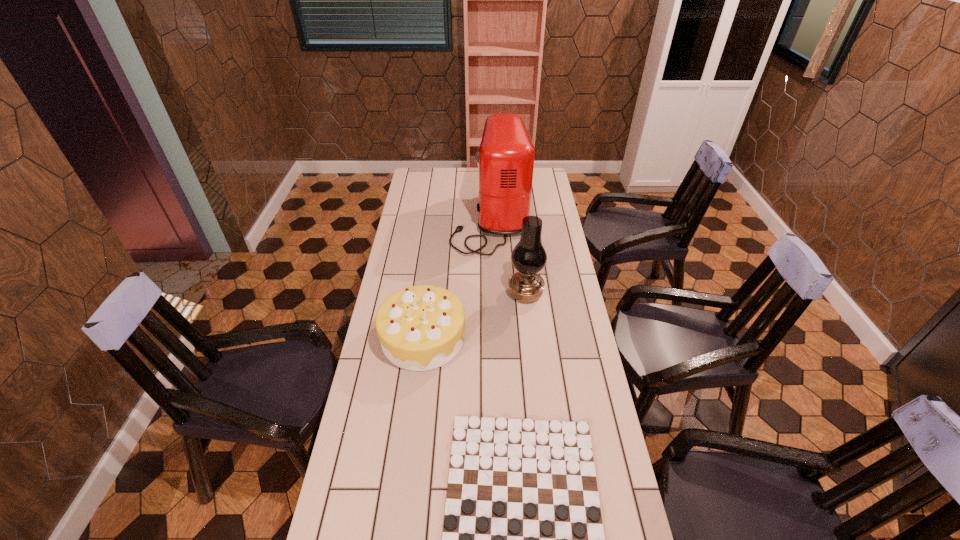
Find the location of a particular element. the tallest object is located at coordinates (505, 159).

What are the coordinates of `the farthest object` in the screenshot? It's located at (505, 159).

Find the location of a particular element. The height and width of the screenshot is (540, 960). the second farthest object is located at coordinates (529, 257).

You are a GUI agent. You are given a task and a screenshot of the screen. Output one action in this format:
    pyautogui.click(x=<x>, y=<y>)
    Task: Click on the oil lamp
    The height and width of the screenshot is (540, 960).
    Given the screenshot: What is the action you would take?
    pyautogui.click(x=529, y=257)

The width and height of the screenshot is (960, 540). I want to click on the third tallest object, so click(422, 327).

What are the coordinates of `the second nearest object` in the screenshot? It's located at (422, 327).

This screenshot has width=960, height=540. In order to click on vacant region located on the front-facing side of the kitchen mixer in this screenshot , I will do `click(439, 220)`.

What are the coordinates of `vacant position located 0.140m on the front-facing side of the kitchen mixer` in the screenshot? It's located at (422, 220).

You are a GUI agent. You are given a task and a screenshot of the screen. Output one action in this format:
    pyautogui.click(x=<x>, y=<y>)
    Task: Click on the free region located on the front-facing side of the kitchen mixer
    This screenshot has width=960, height=540.
    Given the screenshot: What is the action you would take?
    pyautogui.click(x=428, y=220)

Where is `vacant region located 0.050m on the right of the third shortest object`? The image size is (960, 540). vacant region located 0.050m on the right of the third shortest object is located at coordinates coord(556,294).